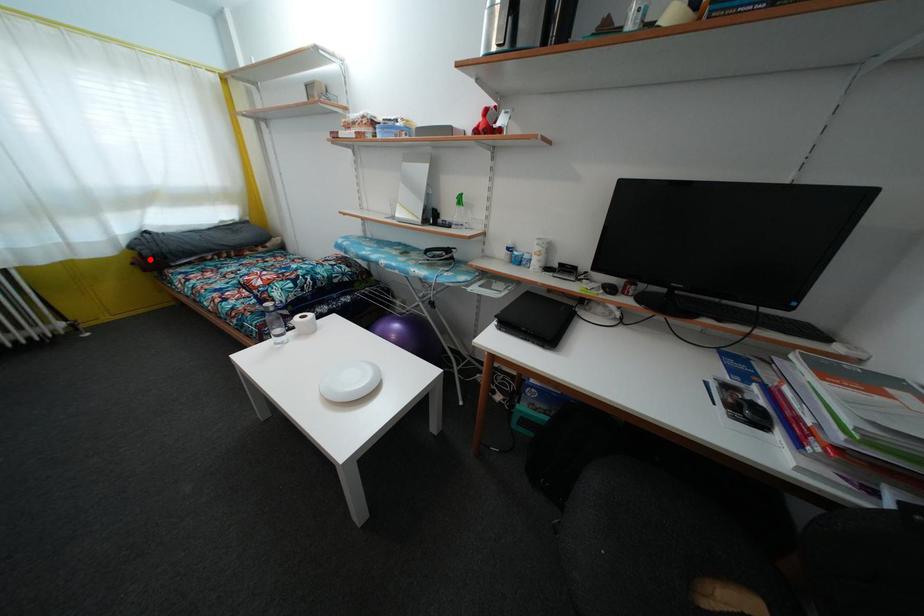
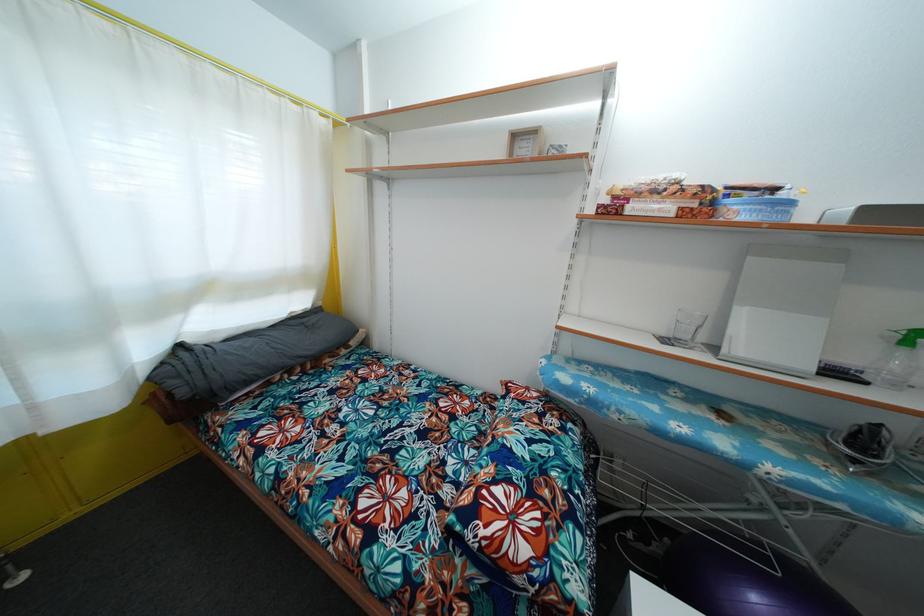
Locate, in the second image, the point that corresponds to the highlighted location in the first image.

(187, 399)